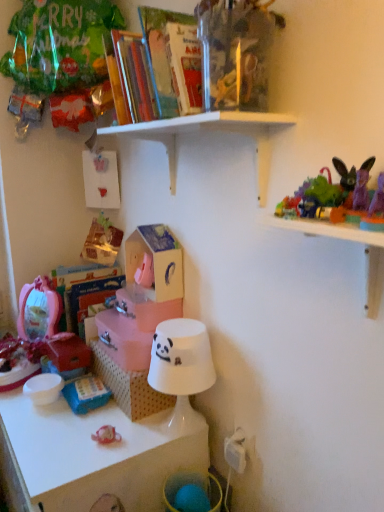
Question: Considering the relative sizes of pink fabric toy at lower left, acting as the first toy starting from the left, and wooden house at center, the first storage box positioned from the top, in the image provided, is pink fabric toy at lower left, acting as the first toy starting from the left, smaller than wooden house at center, the first storage box positioned from the top,?

Choices:
 (A) no
 (B) yes

Answer: (B)

Question: Considering the relative positions of pink fabric toy at lower left, which ranks as the first toy in back-to-front order, and wooden house at center, which is the second storage box from bottom to top, in the image provided, is pink fabric toy at lower left, which ranks as the first toy in back-to-front order, to the left of wooden house at center, which is the second storage box from bottom to top, from the viewer's perspective?

Choices:
 (A) no
 (B) yes

Answer: (B)

Question: Is pink fabric toy at lower left, the third toy when ordered from right to left, thinner than wooden house at center, which is the second storage box from bottom to top?

Choices:
 (A) no
 (B) yes

Answer: (B)

Question: Is pink fabric toy at lower left, acting as the first toy starting from the left, positioned beyond the bounds of wooden house at center, which is the second storage box from bottom to top?

Choices:
 (A) yes
 (B) no

Answer: (A)

Question: Is pink fabric toy at lower left, which ranks as the first toy in back-to-front order, not near wooden house at center, the first storage box positioned from the top?

Choices:
 (A) no
 (B) yes

Answer: (A)

Question: From the image's perspective, is pink fabric toy at lower left, acting as the third toy starting from the front, under wooden house at center, the first storage box positioned from the top?

Choices:
 (A) yes
 (B) no

Answer: (A)

Question: From the image's perspective, is hardcover book at upper center under white cardboard box at center?

Choices:
 (A) no
 (B) yes

Answer: (A)

Question: Is hardcover book at upper center shorter than white cardboard box at center?

Choices:
 (A) no
 (B) yes

Answer: (A)

Question: Is hardcover book at upper center not within white cardboard box at center?

Choices:
 (A) no
 (B) yes

Answer: (B)

Question: Can you confirm if hardcover book at upper center is thinner than white cardboard box at center?

Choices:
 (A) yes
 (B) no

Answer: (A)

Question: Considering the relative sizes of hardcover book at upper center and white cardboard box at center in the image provided, is hardcover book at upper center wider than white cardboard box at center?

Choices:
 (A) no
 (B) yes

Answer: (A)

Question: Considering the relative positions of hardcover book at upper center and white cardboard box at center in the image provided, is hardcover book at upper center to the left of white cardboard box at center from the viewer's perspective?

Choices:
 (A) no
 (B) yes

Answer: (A)

Question: Is white wooden shelf at upper center, arranged as the first shelf when viewed from the top, facing away from transparent plastic toys at upper right, arranged as the second shelf when viewed from the top?

Choices:
 (A) no
 (B) yes

Answer: (A)